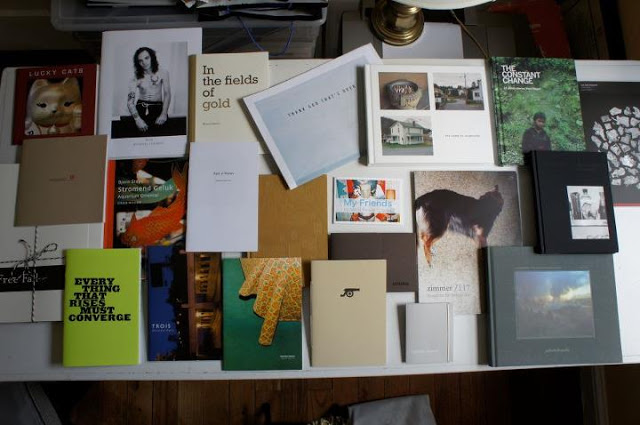
The image size is (640, 425). I want to click on picture, so click(559, 343).